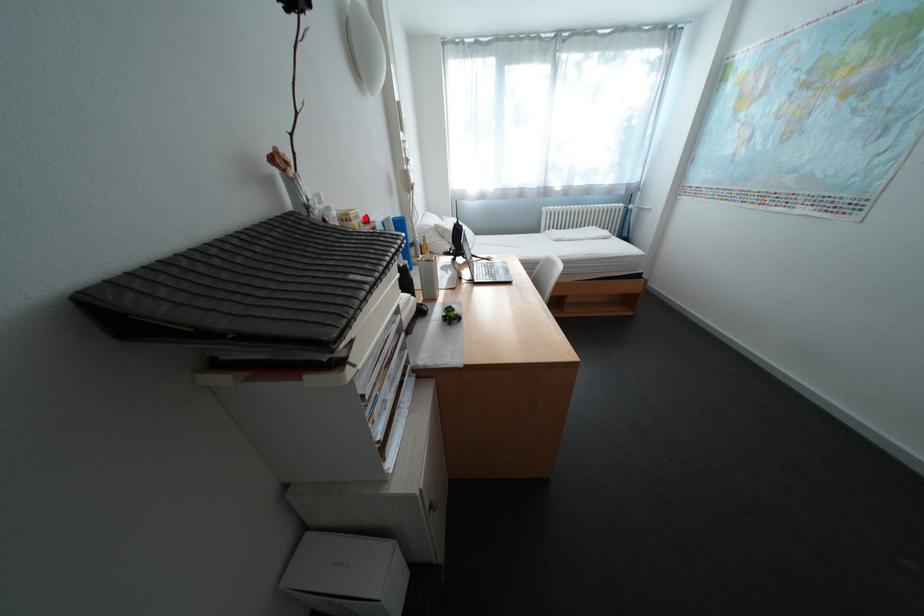
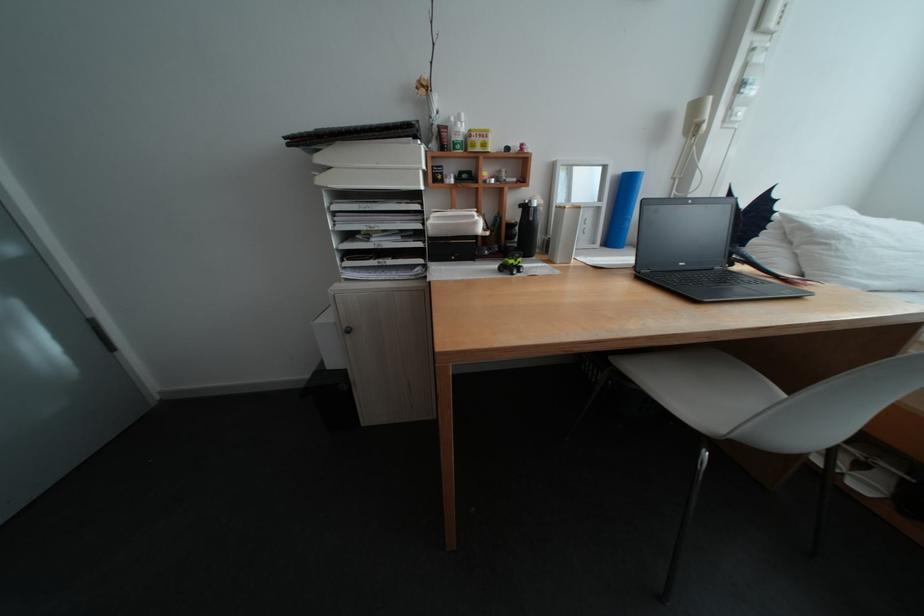
Question: I am providing you with two images of the same scene from different viewpoints. A red point is shown in image1. For the corresponding object point in image2, is it positioned nearer or farther from the camera?

Choices:
 (A) Nearer
 (B) Farther

Answer: (A)